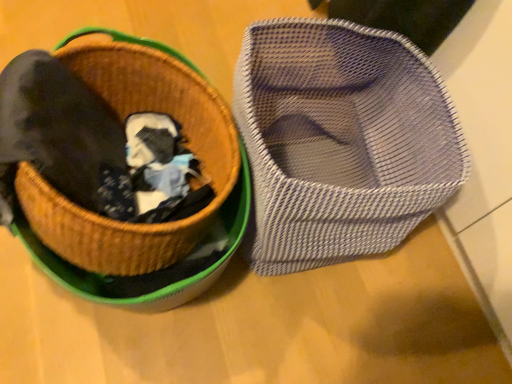
Locate an element on the screen. Image resolution: width=512 pixels, height=384 pixels. free location in front of mesh fabric shoe at right is located at coordinates (294, 339).